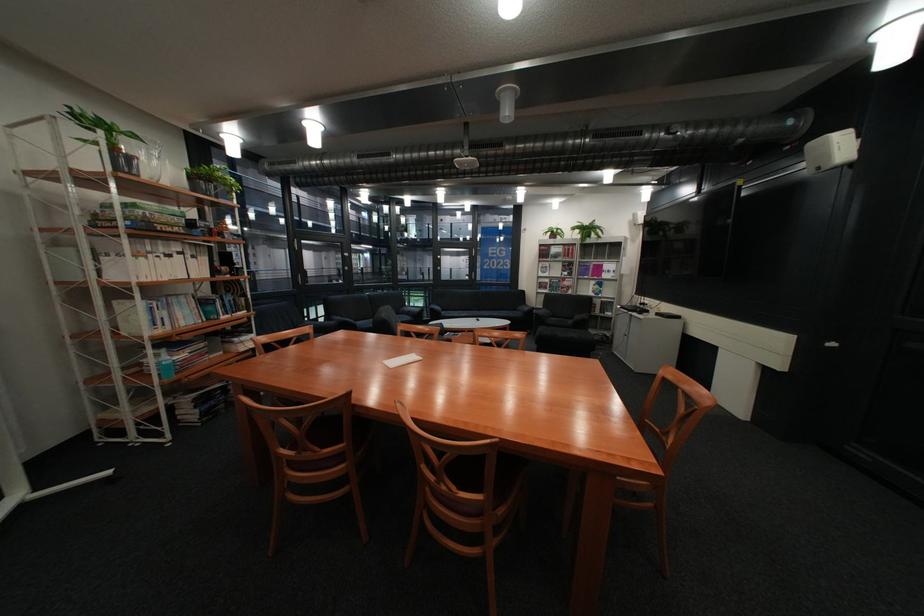
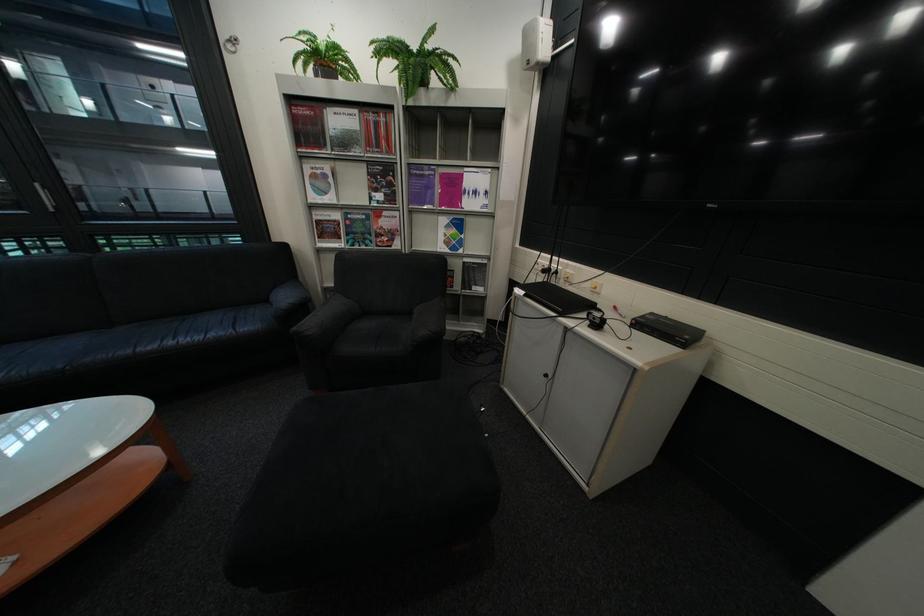
In the second image, find the point that corresponds to point (658, 304) in the first image.

(563, 270)